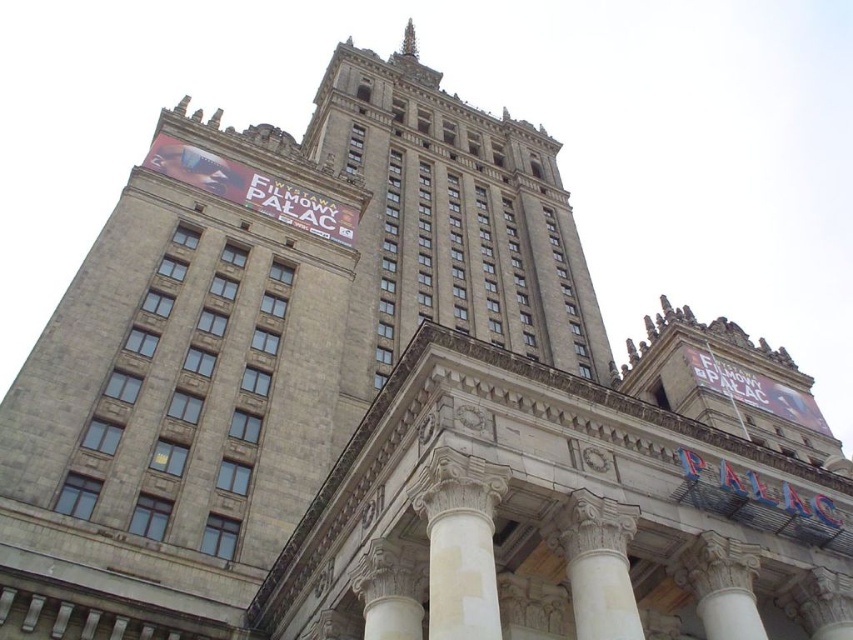
Question: Which of the following is the farthest from the observer?

Choices:
 (A) (589, 568)
 (B) (698, 563)

Answer: (B)

Question: Where is white marble column at center located in relation to white marble pillar at center in the image?

Choices:
 (A) below
 (B) above

Answer: (B)

Question: Which object appears closest to the camera in this image?

Choices:
 (A) white marble column at center
 (B) white marble pillar at center

Answer: (A)

Question: Can you confirm if white marble column at center is smaller than white marble pillar at center?

Choices:
 (A) no
 (B) yes

Answer: (B)

Question: Is white marble column at center wider than white marble pillar at center?

Choices:
 (A) no
 (B) yes

Answer: (A)

Question: Which of the following is the farthest from the observer?

Choices:
 (A) (607, 560)
 (B) (683, 577)

Answer: (B)